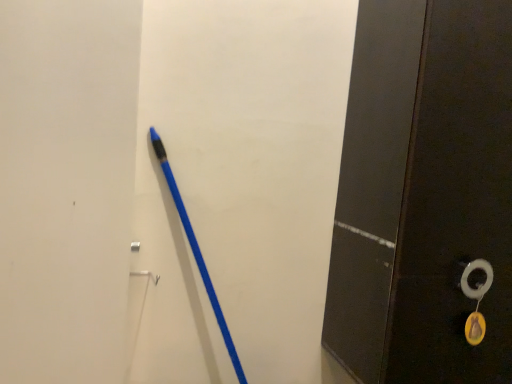
This screenshot has height=384, width=512. What do you see at coordinates (425, 196) in the screenshot?
I see `dark brown wooden door at right` at bounding box center [425, 196].

Where is `dark brown wooden door at right`? The height and width of the screenshot is (384, 512). dark brown wooden door at right is located at coordinates (425, 196).

What is the approximate height of dark brown wooden door at right?

The height of dark brown wooden door at right is 3.61 feet.

Where is `dark brown wooden door at right`? Image resolution: width=512 pixels, height=384 pixels. dark brown wooden door at right is located at coordinates (425, 196).